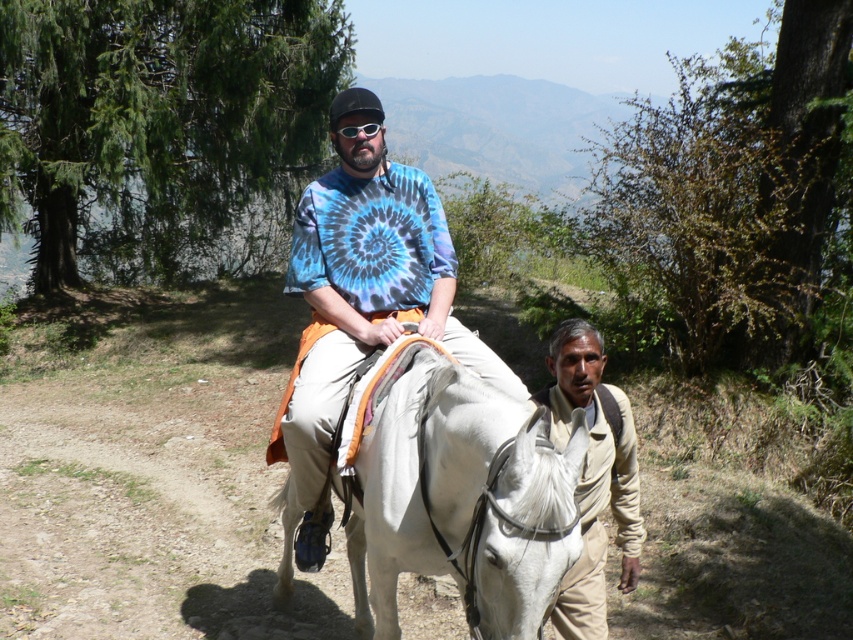
Does white glossy horse at center appear on the right side of beige cotton shirt at lower right?

Incorrect, white glossy horse at center is not on the right side of beige cotton shirt at lower right.

This screenshot has height=640, width=853. Identify the location of white glossy horse at center. (456, 493).

What do you see at coordinates (361, 296) in the screenshot?
I see `tie-dye fabric shirt at center` at bounding box center [361, 296].

Where is `tie-dye fabric shirt at center`? tie-dye fabric shirt at center is located at coordinates (361, 296).

How distant is white glossy horse at center from tie-dye fabric shirt at center?

white glossy horse at center is 17.92 inches from tie-dye fabric shirt at center.

Between point (386, 384) and point (374, 160), which one is positioned behind?

Point (374, 160)

Locate an element on the screen. The height and width of the screenshot is (640, 853). white glossy horse at center is located at coordinates (456, 493).